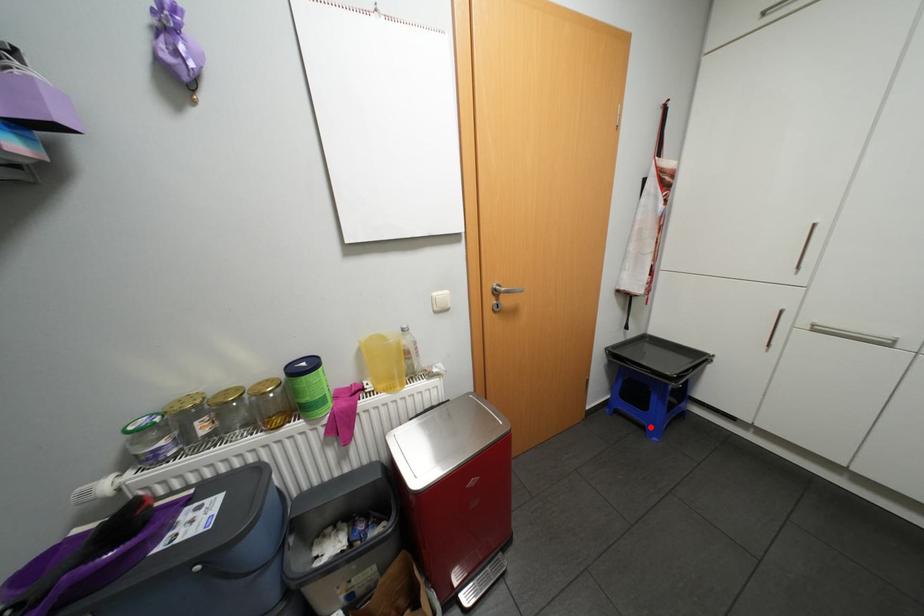
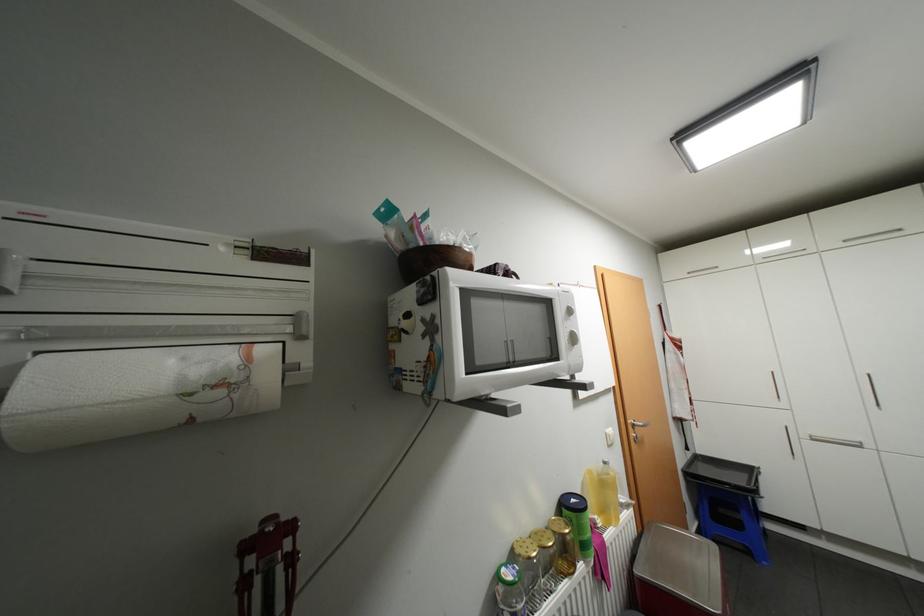
Locate, in the second image, the point that corresponds to the highlighted location in the first image.

(756, 552)